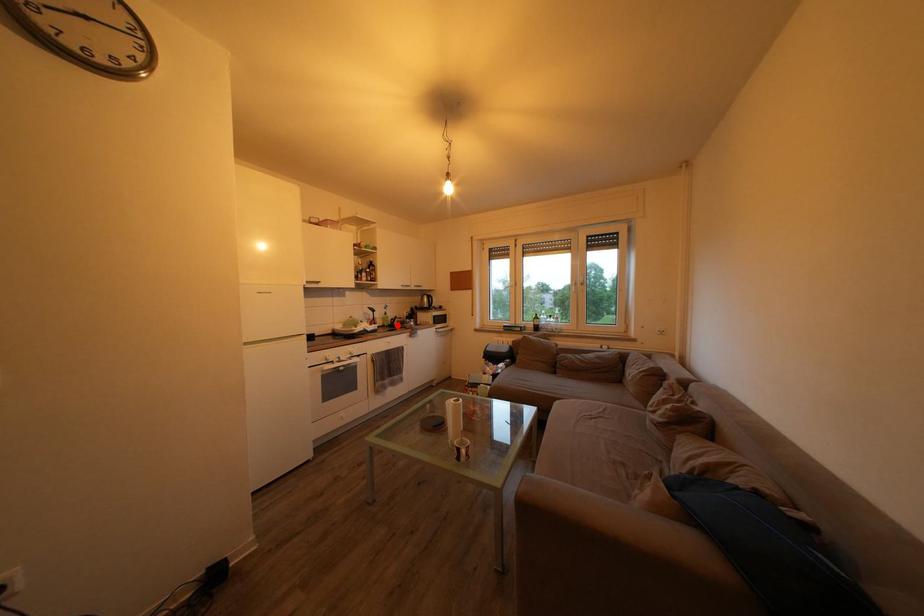
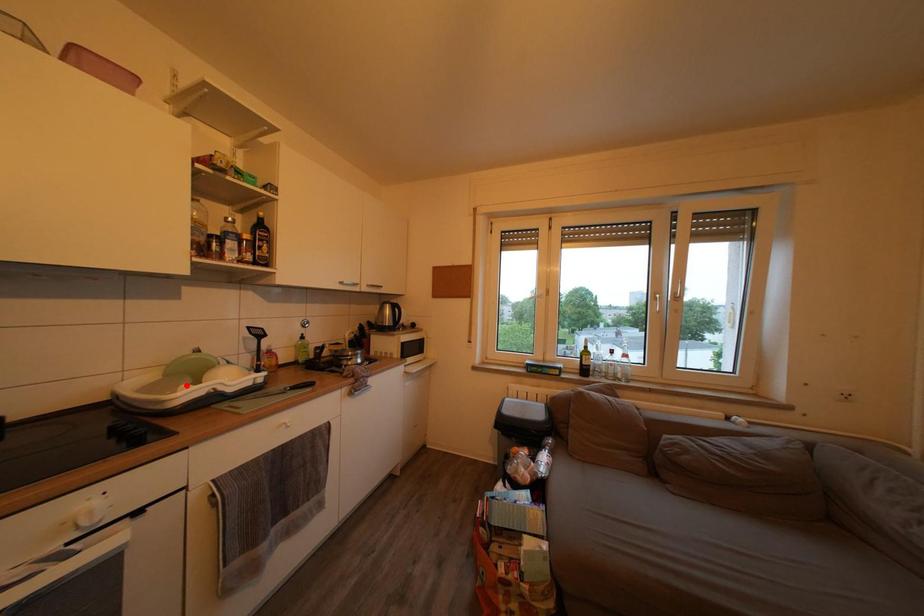
I am providing you with two images of the same scene from different viewpoints. A red point is marked on the first image and another point is marked on the second image. Is the marked point in image1 the same physical position as the marked point in image2?

No